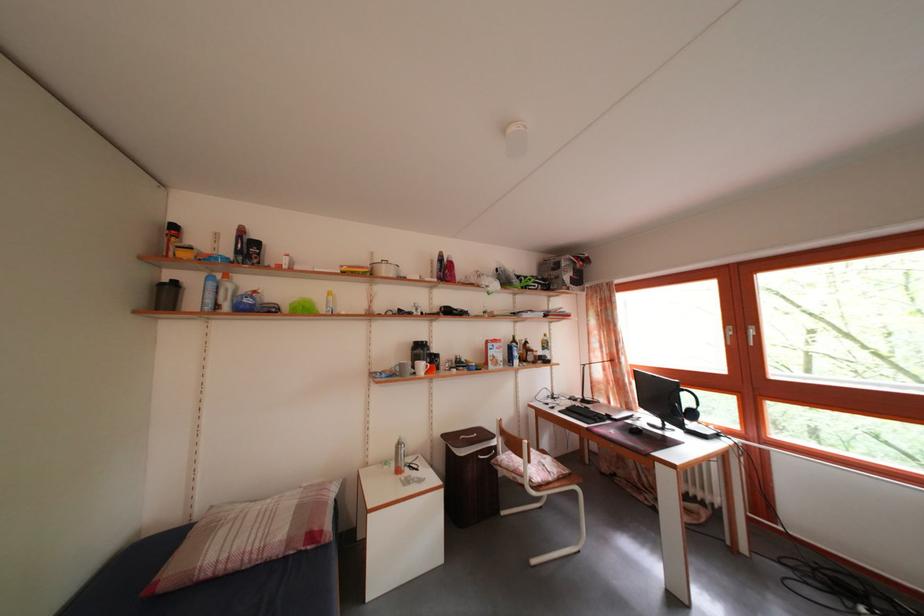
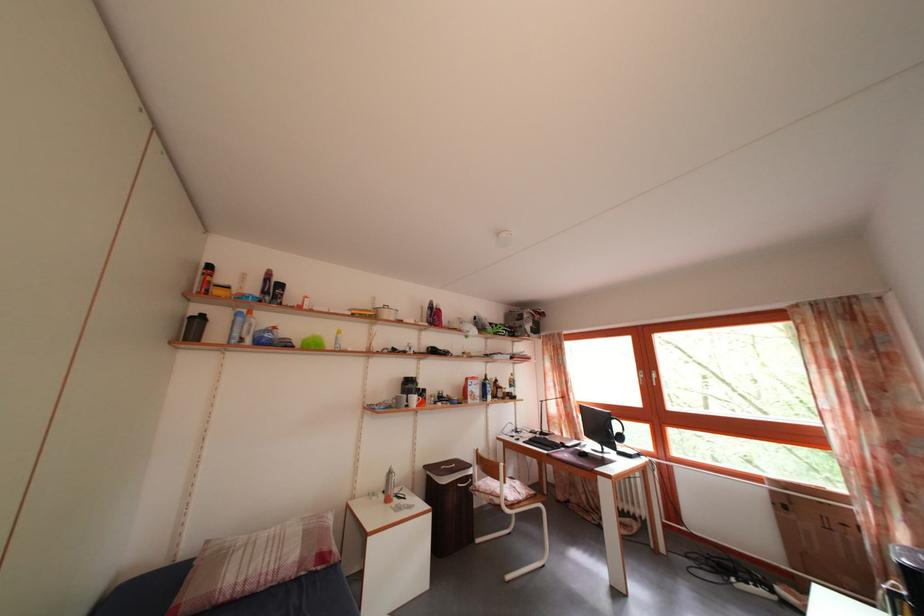
Find the pixel in the second image that matches the point at 241,573 in the first image.

(257, 594)